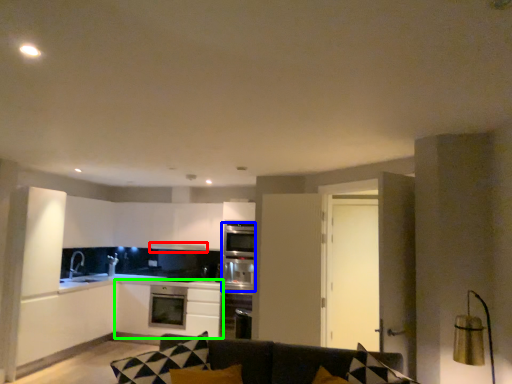
Question: Estimate the real-world distances between objects in this image. Which object is farther from exhaust hood (highlighted by a red box), oven (highlighted by a blue box) or cabinetry (highlighted by a green box)?

Choices:
 (A) oven
 (B) cabinetry

Answer: (B)